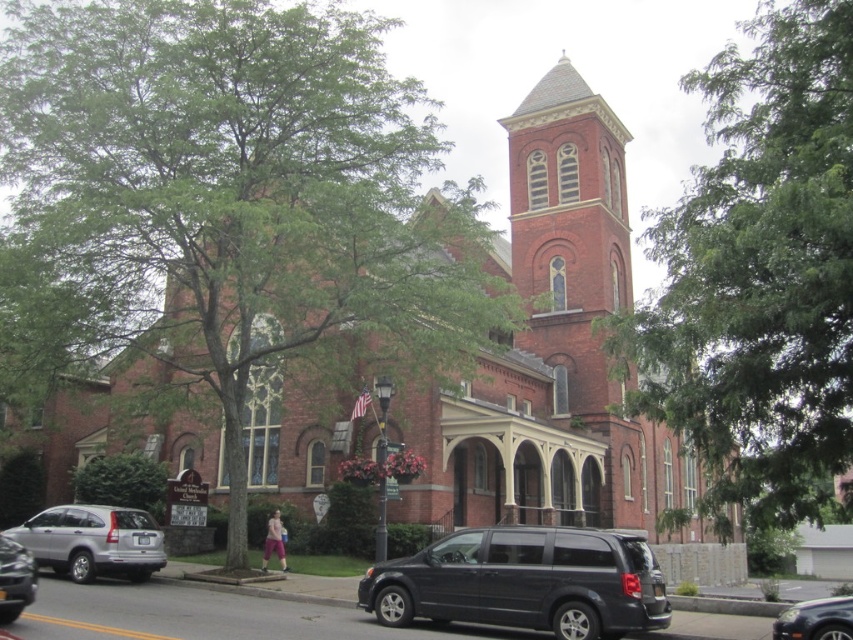
You are a delivery driver who needs to park your van without blocking the entrance of the historic brick church. The entrance is near the green leafy tree at left. Can you park the silver metallic van at lower left at least 20 meters away from the tree?

The green leafy tree at left and silver metallic van at lower left are 26.82 meters apart, so yes, the van can be parked at least 20 meters away from the tree.

You are standing at the entrance of the historic brick church and want to locate the point marked at coordinates point (759, 275). Based on the scene description, where would this point be located?

The point (759, 275) is located on the green leafy tree at upper right.

You are standing in front of the historic brick church and want to take a photo of both the green leafy tree at upper right and the silver metallic van at lower left. Which object should you focus on first to ensure both are in the frame?

You should focus on the green leafy tree at upper right first because it is closer to the viewer than the silver metallic van at lower left, so adjusting the camera to include the closer object will help frame the farther one as well.